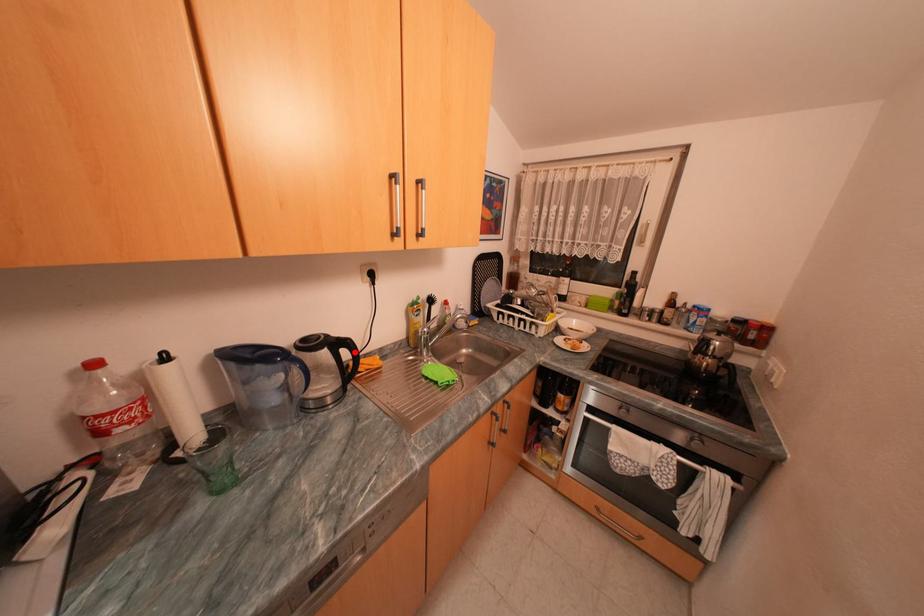
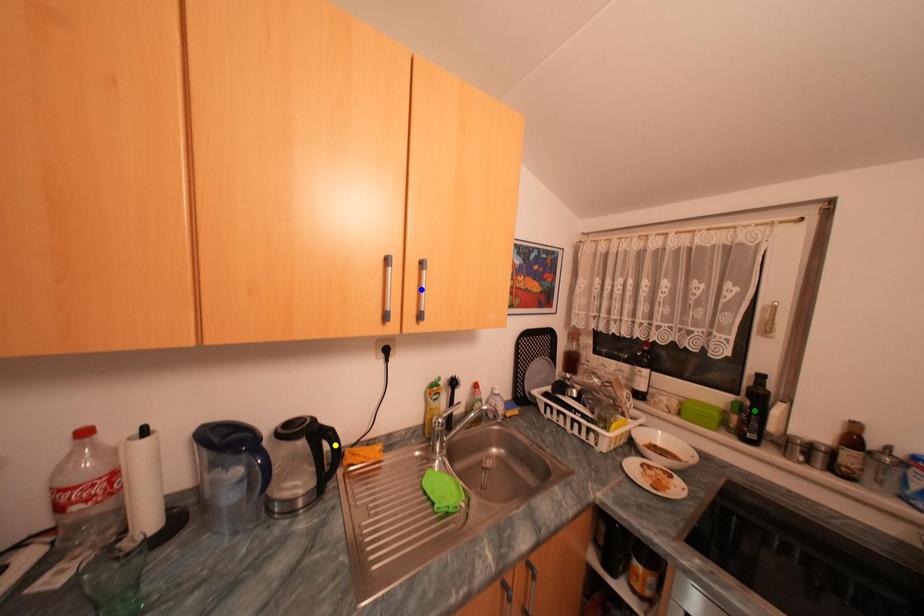
Question: I am providing you with two images of the same scene from different viewpoints. A red point is marked on the first image. You are given multiple points on the second image. Which spot in image 2 lines up with the point in image 1?

Choices:
 (A) green point
 (B) blue point
 (C) yellow point

Answer: (C)